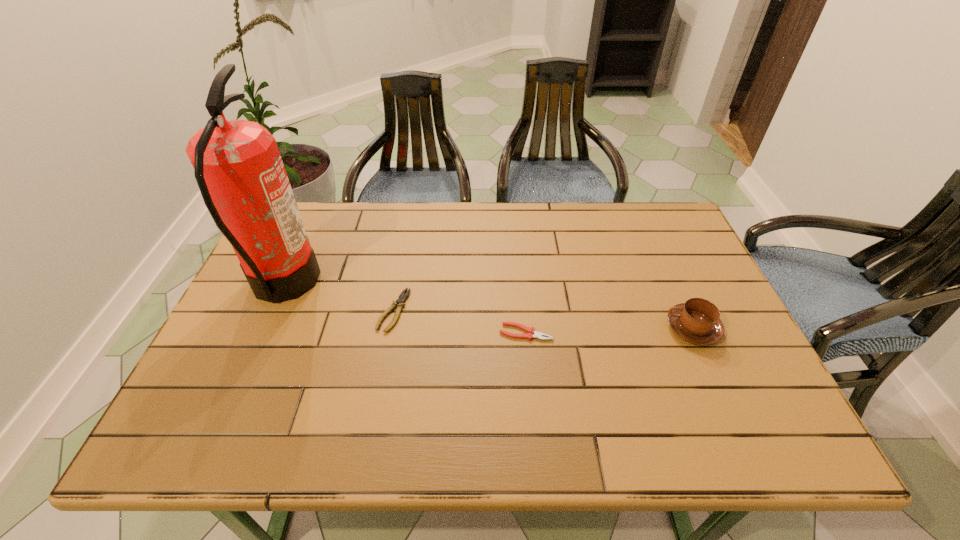
At what (x,y) coordinates should I click in order to perform the action: click on empty space between the cappuccino and the fire extinguisher. Please return your answer as a coordinate pair (x, y). The height and width of the screenshot is (540, 960). Looking at the image, I should click on (489, 306).

The width and height of the screenshot is (960, 540). Find the location of `empty space that is in between the left pliers and the third shortest object`. empty space that is in between the left pliers and the third shortest object is located at coordinates (543, 320).

Find the location of a particular element. empty space between the second object from left to right and the second object from right to left is located at coordinates (460, 321).

The image size is (960, 540). In order to click on vacant area between the rightmost object and the tallest object in this screenshot , I will do `click(489, 306)`.

Where is `free space that is in between the rightmost object and the third object from left to right`? Image resolution: width=960 pixels, height=540 pixels. free space that is in between the rightmost object and the third object from left to right is located at coordinates (610, 330).

The width and height of the screenshot is (960, 540). I want to click on vacant area between the third object from right to left and the tallest object, so click(339, 297).

This screenshot has width=960, height=540. What are the coordinates of `empty space between the left pliers and the fire extinguisher` in the screenshot? It's located at (339, 297).

Identify the location of free point between the left pliers and the fire extinguisher. The image size is (960, 540). click(x=339, y=297).

Select which object appears as the third closest to the third object from right to left. Please provide its 2D coordinates. Your answer should be formatted as a tuple, i.e. [(x, y)], where the tuple contains the x and y coordinates of a point satisfying the conditions above.

[(697, 321)]

Identify which object is the second nearest to the leftmost object. Please provide its 2D coordinates. Your answer should be formatted as a tuple, i.e. [(x, y)], where the tuple contains the x and y coordinates of a point satisfying the conditions above.

[(539, 335)]